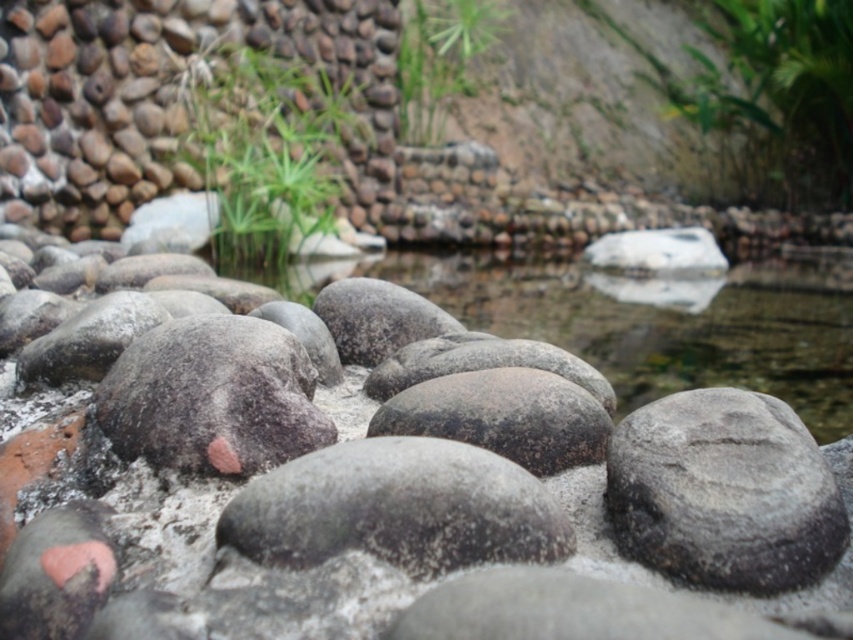
You are a gardener who needs to water both the green leafy plant at upper right and the green grass at upper center. Your watering can holds enough water for 3 meters of travel. Can you water both without refilling?

The distance between the green leafy plant at upper right and green grass at upper center is 3.54 meters. Since your watering can only allows 3 meters of travel, you cannot reach both without refilling.

You are a photographer setting up a shot of the serene outdoor scene. You want to ensure both the green leafy plant at upper right and the green grass at upper center are in focus. Since you can only focus on one plane, which object should you focus on to include both in your composition?

You should focus on the green leafy plant at upper right because the green grass at upper center is behind it, so focusing on the closer object will keep both in focus.